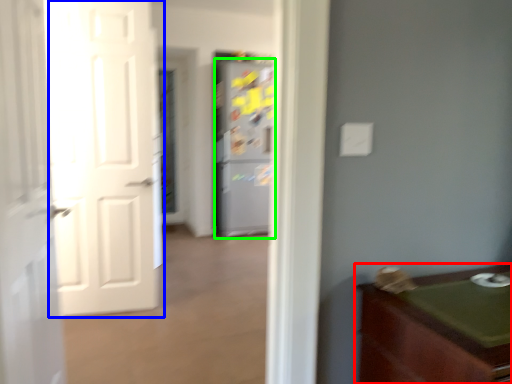
Question: Which is farther away from cabinetry (highlighted by a red box)? door (highlighted by a blue box) or refrigerator (highlighted by a green box)?

Choices:
 (A) door
 (B) refrigerator

Answer: (B)